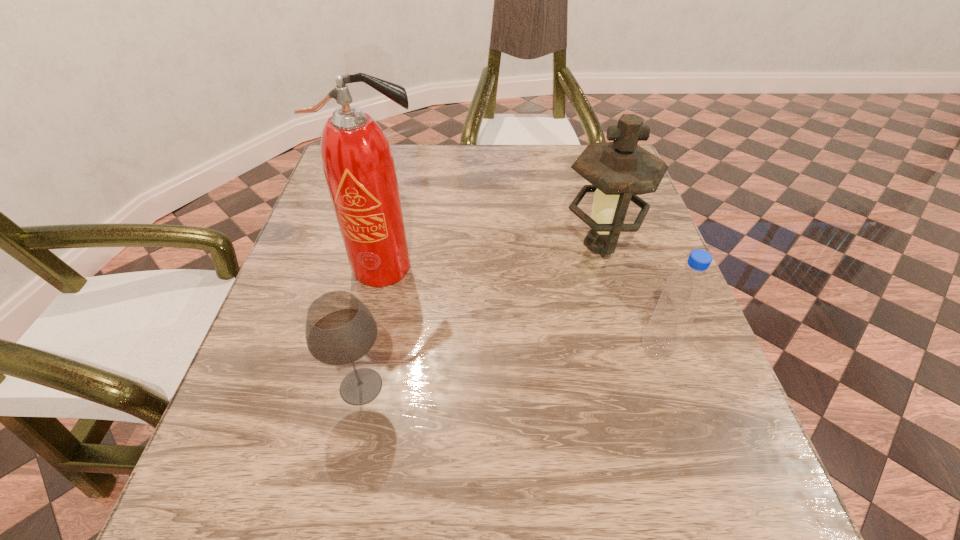
Find the location of a particular element. The width and height of the screenshot is (960, 540). oil lamp located in the right edge section of the desktop is located at coordinates (619, 171).

What are the coordinates of `water bottle located at the right edge` in the screenshot? It's located at (685, 290).

Identify the location of free space at the far edge of the desktop. The width and height of the screenshot is (960, 540). (482, 146).

In the image, there is a desktop. Where is `vacant space at the near edge`? vacant space at the near edge is located at coordinates (654, 518).

Where is `vacant point at the left edge`? vacant point at the left edge is located at coordinates (312, 225).

Identify the location of free region at the right edge. (692, 417).

The width and height of the screenshot is (960, 540). Find the location of `free space that is in between the shortest object and the second tallest object`. free space that is in between the shortest object and the second tallest object is located at coordinates (481, 315).

Identify the location of free space between the fire extinguisher and the water bottle. The width and height of the screenshot is (960, 540). (521, 308).

You are a GUI agent. You are given a task and a screenshot of the screen. Output one action in this format:
    pyautogui.click(x=<x>, y=<y>)
    Task: Click on the free space between the third shortest object and the water bottle
    
    Given the screenshot: What is the action you would take?
    pyautogui.click(x=629, y=297)

Find the location of a particular element. vacant space in between the water bottle and the third shortest object is located at coordinates (629, 297).